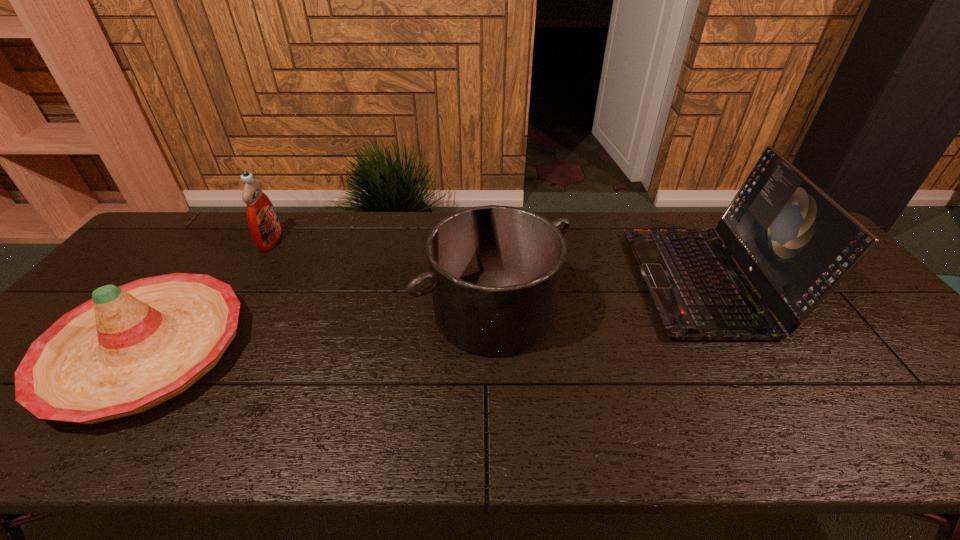
Identify the location of detergent that is positioned at the far edge. (262, 219).

Where is `vacant space at the far edge of the desktop`? This screenshot has width=960, height=540. vacant space at the far edge of the desktop is located at coordinates (413, 218).

This screenshot has height=540, width=960. In the image, there is a desktop. Find the location of `vacant space at the near edge`. vacant space at the near edge is located at coordinates (791, 416).

In the image, there is a desktop. Identify the location of free region at the right edge. (923, 398).

Where is `vacant space that's between the tallest object and the pan`? Image resolution: width=960 pixels, height=540 pixels. vacant space that's between the tallest object and the pan is located at coordinates (599, 296).

This screenshot has height=540, width=960. Identify the location of unoccupied position between the detergent and the pan. (382, 276).

Locate an element on the screen. This screenshot has height=540, width=960. the third closest object relative to the detergent is located at coordinates (794, 242).

Where is `object that is the second closest to the detergent`? object that is the second closest to the detergent is located at coordinates (495, 271).

Where is `vacant space that satisfies the following two spatial constraints: 1. on the front surface of the detergent; 2. on the left side of the pan`? This screenshot has height=540, width=960. vacant space that satisfies the following two spatial constraints: 1. on the front surface of the detergent; 2. on the left side of the pan is located at coordinates (228, 312).

This screenshot has height=540, width=960. Identify the location of free spot that satisfies the following two spatial constraints: 1. on the screen of the rightmost object; 2. on the front side of the pan. (720, 312).